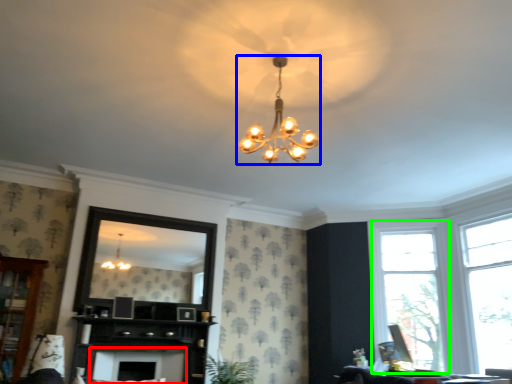
Question: Which is farther away from fireplace (highlighted by a red box)? lamp (highlighted by a blue box) or window (highlighted by a green box)?

Choices:
 (A) lamp
 (B) window

Answer: (B)